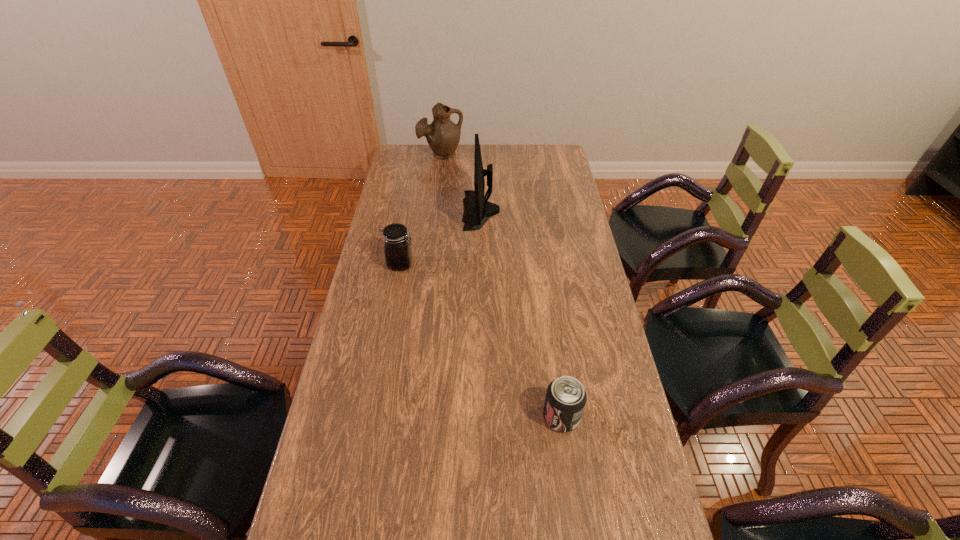
Where is `free space that is in between the third nearest object and the second nearest object`? Image resolution: width=960 pixels, height=540 pixels. free space that is in between the third nearest object and the second nearest object is located at coordinates (441, 237).

Identify which object is the third nearest to the third object from left to right. Please provide its 2D coordinates. Your answer should be formatted as a tuple, i.e. [(x, y)], where the tuple contains the x and y coordinates of a point satisfying the conditions above.

[(565, 400)]

Locate which object ranks second in proximity to the second nearest object. Please provide its 2D coordinates. Your answer should be formatted as a tuple, i.e. [(x, y)], where the tuple contains the x and y coordinates of a point satisfying the conditions above.

[(565, 400)]

Where is `vacant space that satisfies the following two spatial constraints: 1. at the spout of the farthest object; 2. on the right side of the nearest object`? Image resolution: width=960 pixels, height=540 pixels. vacant space that satisfies the following two spatial constraints: 1. at the spout of the farthest object; 2. on the right side of the nearest object is located at coordinates (409, 416).

Image resolution: width=960 pixels, height=540 pixels. In order to click on vacant space that satisfies the following two spatial constraints: 1. at the spout of the pitcher; 2. on the lid of the third farthest object in this screenshot , I will do (428, 264).

Find the location of a particular element. free space that satisfies the following two spatial constraints: 1. on the screen side of the shortest object; 2. on the left side of the monitor is located at coordinates (482, 416).

At what (x,y) coordinates should I click in order to perform the action: click on vacant space that satisfies the following two spatial constraints: 1. on the lid of the jar; 2. on the back side of the shortest object. Please return your answer as a coordinate pair (x, y). This screenshot has width=960, height=540. Looking at the image, I should click on (372, 416).

You are a GUI agent. You are given a task and a screenshot of the screen. Output one action in this format:
    pyautogui.click(x=<x>, y=<y>)
    Task: Click on the vacant area that satisfies the following two spatial constraints: 1. at the spout of the nearest object; 2. on the left side of the pitcher
    
    Given the screenshot: What is the action you would take?
    pyautogui.click(x=409, y=416)

This screenshot has width=960, height=540. Identify the location of vacant space that satisfies the following two spatial constraints: 1. on the screen side of the soda can; 2. on the right side of the monitor. (482, 416).

I want to click on free location that satisfies the following two spatial constraints: 1. on the screen side of the monitor; 2. on the back side of the shortest object, so click(482, 416).